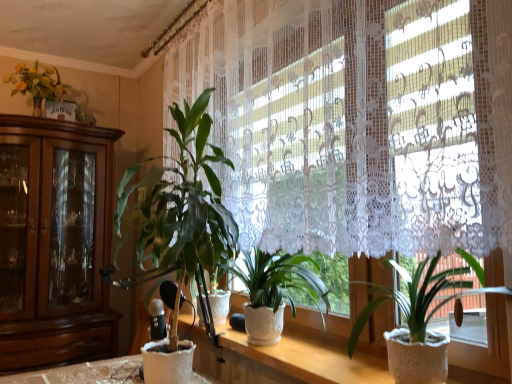
Question: Is white textured pot at center, which is counted as the 2th houseplant, starting from the left, outside white textured pot at center, which appears as the third houseplant when viewed from the left?

Choices:
 (A) no
 (B) yes

Answer: (B)

Question: Is white textured pot at center, the second houseplant viewed from the right, further to the viewer compared to white textured pot at center, which appears as the third houseplant when viewed from the left?

Choices:
 (A) yes
 (B) no

Answer: (A)

Question: Does white textured pot at center, the second houseplant viewed from the right, have a lesser height compared to white textured pot at center, which appears as the third houseplant when viewed from the left?

Choices:
 (A) yes
 (B) no

Answer: (A)

Question: Is white textured pot at center, which is counted as the 2th houseplant, starting from the left, at the left side of white textured pot at center, the first houseplant positioned from the right?

Choices:
 (A) no
 (B) yes

Answer: (B)

Question: Is white textured pot at center, which is counted as the 2th houseplant, starting from the left, smaller than white textured pot at center, which appears as the third houseplant when viewed from the left?

Choices:
 (A) yes
 (B) no

Answer: (B)

Question: Is white lace curtain at upper center wider or thinner than white textured pot at center, which appears as the third houseplant when viewed from the left?

Choices:
 (A) wide
 (B) thin

Answer: (B)

Question: From a real-world perspective, is white lace curtain at upper center positioned above or below white textured pot at center, the first houseplant positioned from the right?

Choices:
 (A) below
 (B) above

Answer: (B)

Question: Considering the positions of white lace curtain at upper center and white textured pot at center, which appears as the third houseplant when viewed from the left, in the image, is white lace curtain at upper center bigger or smaller than white textured pot at center, which appears as the third houseplant when viewed from the left,?

Choices:
 (A) big
 (B) small

Answer: (A)

Question: In the image, is white lace curtain at upper center positioned in front of or behind white textured pot at center, which appears as the third houseplant when viewed from the left?

Choices:
 (A) behind
 (B) front

Answer: (B)

Question: From the image's perspective, is white textured pot at center, the first houseplant positioned from the right, above or below white textured pot at center?

Choices:
 (A) below
 (B) above

Answer: (B)

Question: Considering their positions, is white textured pot at center, which appears as the third houseplant when viewed from the left, located in front of or behind white textured pot at center?

Choices:
 (A) front
 (B) behind

Answer: (A)

Question: Is point (406, 299) positioned closer to the camera than point (309, 379)?

Choices:
 (A) farther
 (B) closer

Answer: (A)

Question: In terms of width, does white textured pot at center, the first houseplant positioned from the right, look wider or thinner when compared to white textured pot at center?

Choices:
 (A) thin
 (B) wide

Answer: (A)

Question: Is green matte plant at center, the 1th houseplant in the left-to-right sequence, inside the boundaries of white textured pot at center, which appears as the third houseplant when viewed from the left, or outside?

Choices:
 (A) inside
 (B) outside

Answer: (B)

Question: In the image, is green matte plant at center, the 1th houseplant in the left-to-right sequence, positioned in front of or behind white textured pot at center, which appears as the third houseplant when viewed from the left?

Choices:
 (A) behind
 (B) front

Answer: (A)